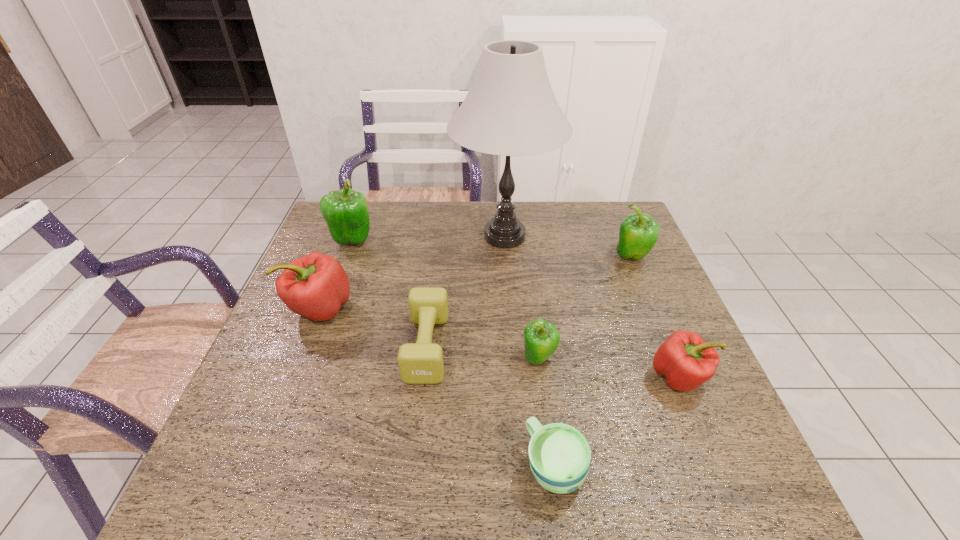
You are a GUI agent. You are given a task and a screenshot of the screen. Output one action in this format:
    pyautogui.click(x=<x>, y=<y>)
    Task: Click on the nearer pink bell pepper
    
    Given the screenshot: What is the action you would take?
    pyautogui.click(x=686, y=361)

Where is `dumbbell`? The image size is (960, 540). dumbbell is located at coordinates (422, 362).

At what (x,y) coordinates should I click in order to perform the action: click on blue cup. Please return your answer as a coordinate pair (x, y). Looking at the image, I should click on (559, 455).

The width and height of the screenshot is (960, 540). Identify the location of cup. (559, 455).

Where is `free point located 0.170m on the front of the lamp`? This screenshot has width=960, height=540. free point located 0.170m on the front of the lamp is located at coordinates (510, 312).

Locate an element on the screen. The height and width of the screenshot is (540, 960). vacant region located on the front of the biggest green bell pepper is located at coordinates (328, 306).

You are a GUI agent. You are given a task and a screenshot of the screen. Output one action in this format:
    pyautogui.click(x=<x>, y=<y>)
    Task: Click on the vacant space located 0.360m on the front of the second biggest green bell pepper
    This screenshot has height=540, width=960.
    Given the screenshot: What is the action you would take?
    pyautogui.click(x=678, y=367)

At what (x,y) coordinates should I click in order to perform the action: click on vacant space located on the front of the left pink bell pepper. Please return your answer as a coordinate pair (x, y). The width and height of the screenshot is (960, 540). Looking at the image, I should click on (284, 402).

The image size is (960, 540). I want to click on free space located on the back of the nearest green bell pepper, so click(528, 272).

Locate an element on the screen. free space located 0.070m on the front of the smaller pink bell pepper is located at coordinates (702, 431).